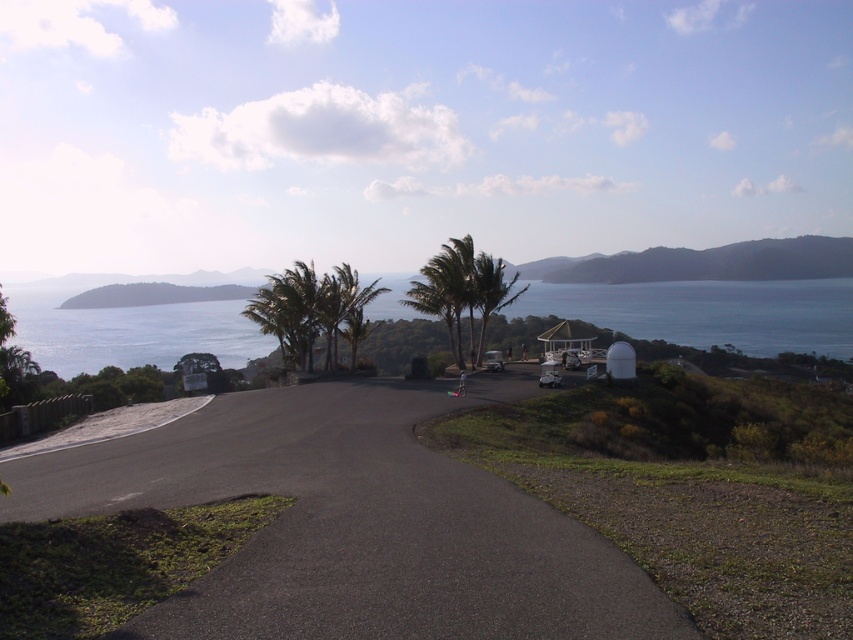
You are driving along the coastal road and notice the blue water at center and the green leafy palm tree at center. Which object is positioned higher in the image?

The blue water at center is located above the green leafy palm tree at center in the image.

You are driving along the coastal road and see the blue water at center and the green leafy palm tree at center. Which one appears closer to you as you look towards the ocean?

The blue water at center appears closer because the green leafy palm tree at center is behind it.